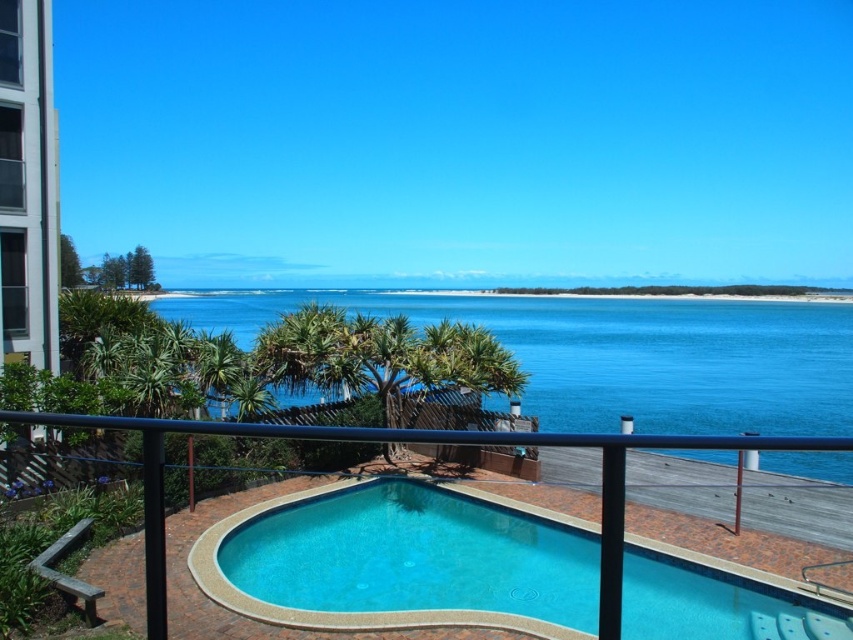
Between smooth concrete pool at center and blue water at center, which one has less height?

With less height is smooth concrete pool at center.

Between smooth concrete pool at center and blue water at center, which one has more height?

blue water at center

Is point (308, 550) closer to camera compared to point (711, 424)?

Yes, point (308, 550) is in front of point (711, 424).

Identify the location of smooth concrete pool at center. (402, 561).